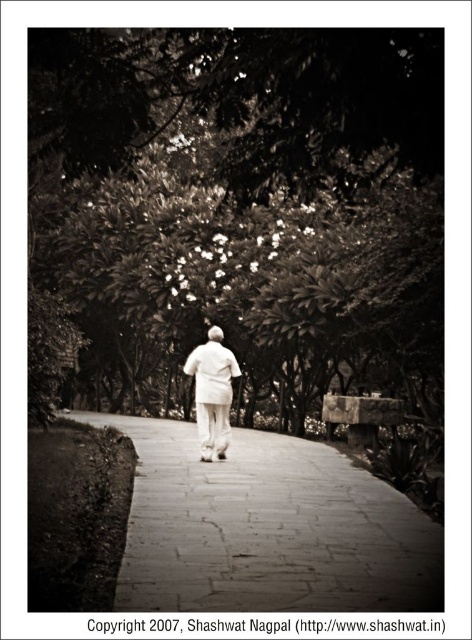
Between paved stone path at center and white matte coat at center, which one appears on the right side from the viewer's perspective?

From the viewer's perspective, paved stone path at center appears more on the right side.

Is paved stone path at center taller than white matte coat at center?

In fact, paved stone path at center may be shorter than white matte coat at center.

Is point (362, 547) closer to viewer compared to point (230, 371)?

Yes, point (362, 547) is closer to viewer.

Image resolution: width=472 pixels, height=640 pixels. I want to click on paved stone path at center, so click(268, 529).

Does green leafy tree at center appear under paved stone path at center?

No, green leafy tree at center is not below paved stone path at center.

Can you confirm if green leafy tree at center is wider than paved stone path at center?

Correct, the width of green leafy tree at center exceeds that of paved stone path at center.

This screenshot has height=640, width=472. Find the location of `green leafy tree at center`. green leafy tree at center is located at coordinates (244, 209).

Which is behind, point (159, 241) or point (207, 451)?

The point (159, 241) is behind.

Is point (43, 205) in front of point (201, 358)?

No, (43, 205) is behind (201, 358).

Where is `green leafy tree at center`? green leafy tree at center is located at coordinates (244, 209).